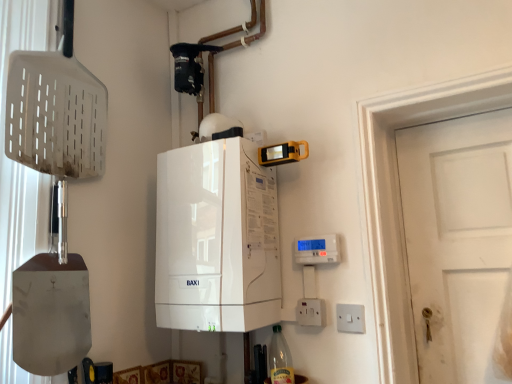
Question: Is clear glass bottle at lower center further to the viewer compared to white plastic electric outlet at lower right, which is the 2th electric outlet from right to left?

Choices:
 (A) no
 (B) yes

Answer: (A)

Question: Is clear glass bottle at lower center positioned far away from white plastic electric outlet at lower right, which is the 2th electric outlet from right to left?

Choices:
 (A) yes
 (B) no

Answer: (B)

Question: Is clear glass bottle at lower center next to white plastic electric outlet at lower right, which is the 2th electric outlet from right to left, and touching it?

Choices:
 (A) yes
 (B) no

Answer: (B)

Question: Is clear glass bottle at lower center to the right of white plastic electric outlet at lower right, which is the 2th electric outlet from right to left, from the viewer's perspective?

Choices:
 (A) yes
 (B) no

Answer: (B)

Question: From a real-world perspective, does clear glass bottle at lower center sit lower than white plastic electric outlet at lower right, which is the 2th electric outlet from right to left?

Choices:
 (A) no
 (B) yes

Answer: (B)

Question: Considering the relative sizes of clear glass bottle at lower center and white plastic electric outlet at lower right, which is the 2th electric outlet from right to left, in the image provided, is clear glass bottle at lower center bigger than white plastic electric outlet at lower right, which is the 2th electric outlet from right to left,?

Choices:
 (A) no
 (B) yes

Answer: (B)

Question: Is the depth of white glossy boiler at center greater than that of clear glass bottle at lower center?

Choices:
 (A) no
 (B) yes

Answer: (A)

Question: Is white glossy boiler at center not inside clear glass bottle at lower center?

Choices:
 (A) yes
 (B) no

Answer: (A)

Question: From a real-world perspective, is white glossy boiler at center on top of clear glass bottle at lower center?

Choices:
 (A) no
 (B) yes

Answer: (B)

Question: Does white glossy boiler at center have a lesser width compared to clear glass bottle at lower center?

Choices:
 (A) no
 (B) yes

Answer: (A)

Question: Does white glossy boiler at center come in front of clear glass bottle at lower center?

Choices:
 (A) no
 (B) yes

Answer: (B)

Question: Is white glossy boiler at center positioned far away from clear glass bottle at lower center?

Choices:
 (A) yes
 (B) no

Answer: (B)

Question: Is white plastic electric outlet at lower right, which is the 2th electric outlet from right to left, oriented away from white glossy boiler at center?

Choices:
 (A) no
 (B) yes

Answer: (A)